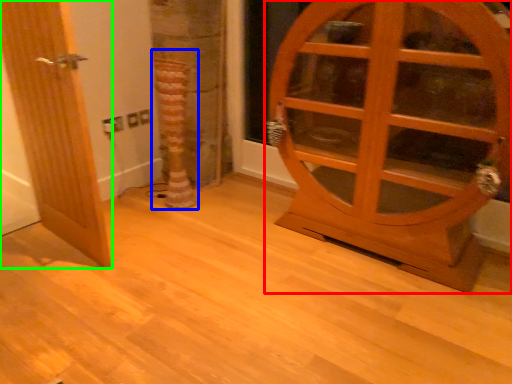
Question: Considering the real-world distances, which object is farthest from door (highlighted by a red box)? tree trunk (highlighted by a blue box) or door (highlighted by a green box)?

Choices:
 (A) tree trunk
 (B) door

Answer: (B)